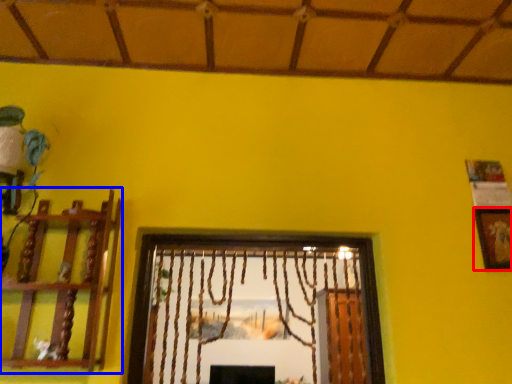
Question: Which object is closer to the camera taking this photo, picture frame (highlighted by a red box) or shelf (highlighted by a blue box)?

Choices:
 (A) picture frame
 (B) shelf

Answer: (B)